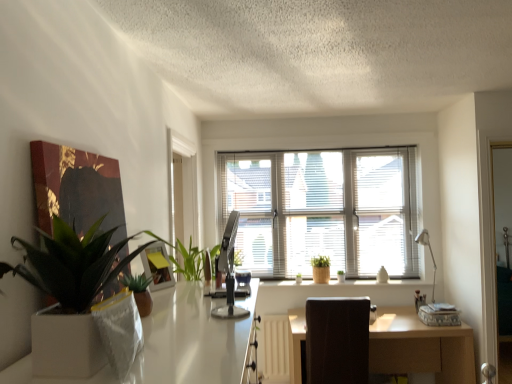
The height and width of the screenshot is (384, 512). Find the location of `vacant region to the right of green matte plant at left, the 2th houseplant from the back`. vacant region to the right of green matte plant at left, the 2th houseplant from the back is located at coordinates tap(199, 349).